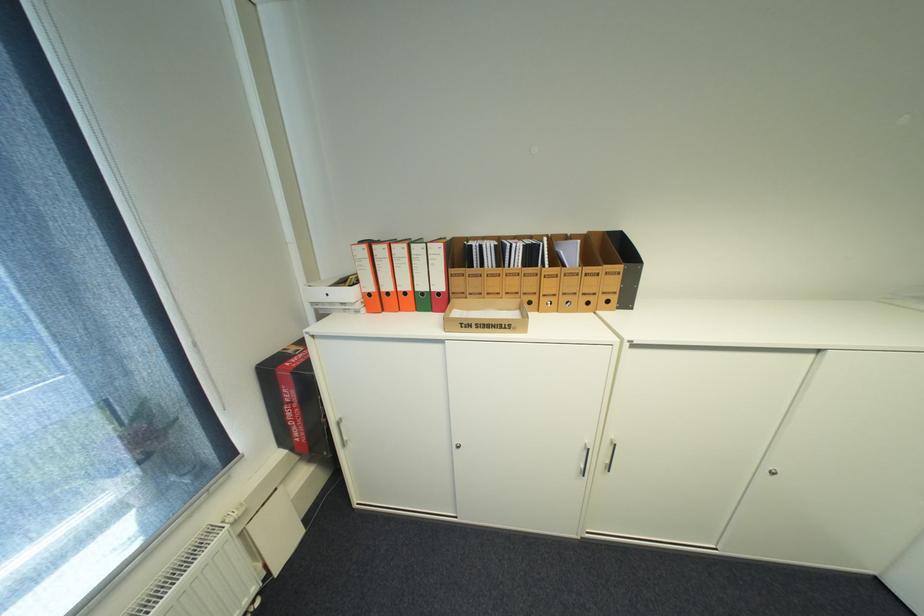
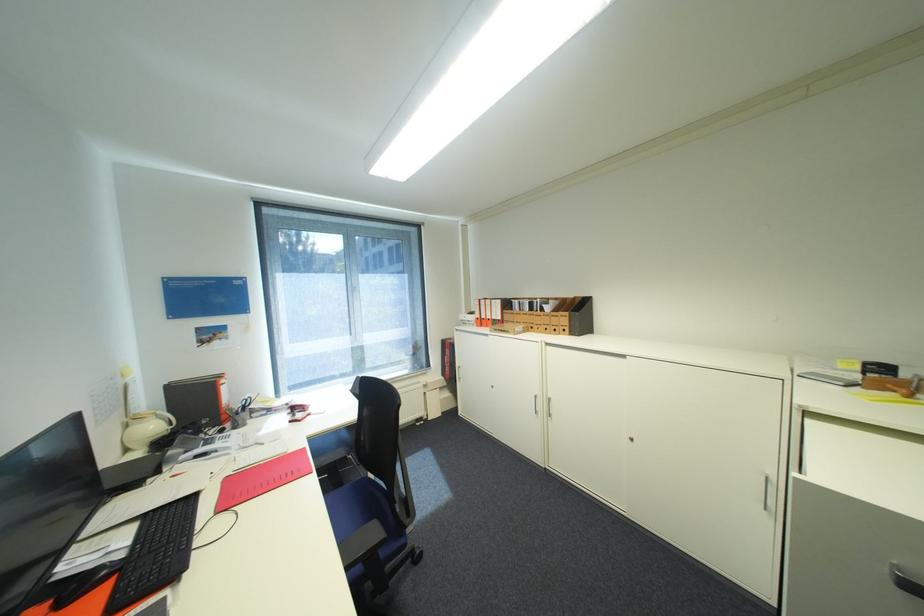
Locate, in the second image, the point that corresponds to pixel 378 294 in the first image.

(485, 318)